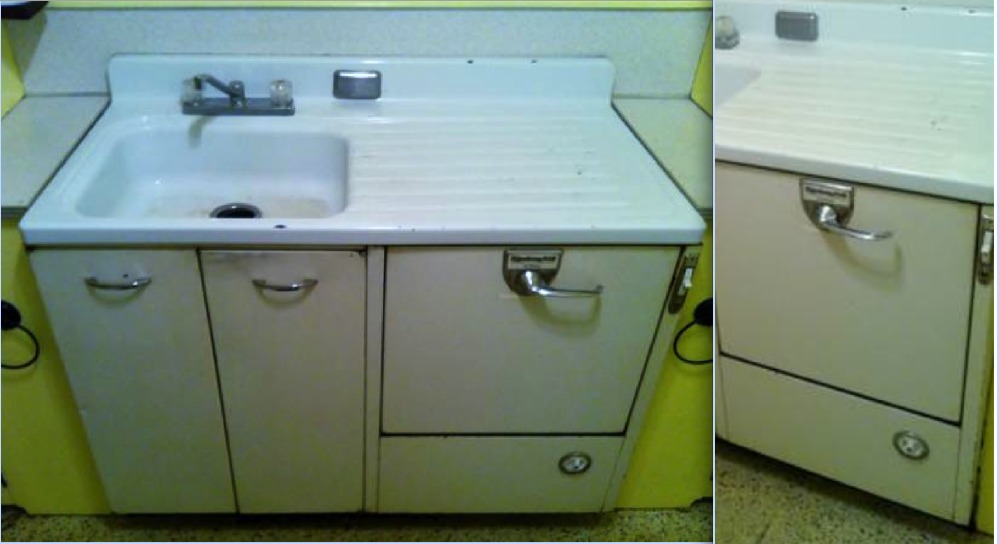
Where is `faucet`? This screenshot has height=544, width=999. faucet is located at coordinates (205, 119).